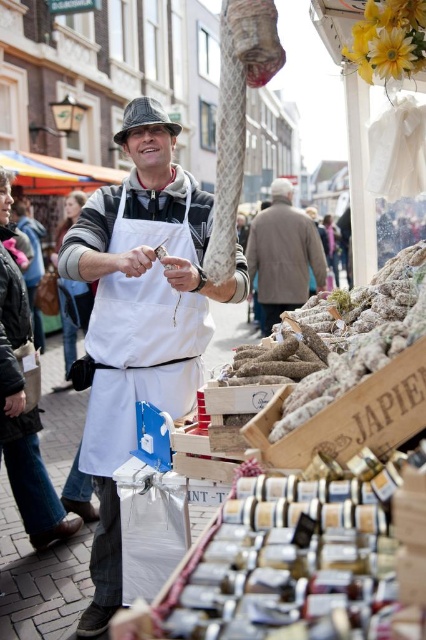
You are a customer at the market and want to determine which clothing item is shorter between the white canvas apron at center and the brown woolen coat at center. Which one is shorter?

The white canvas apron at center is shorter than the brown woolen coat at center because the white canvas apron at center is not as tall as brown woolen coat at center.

You are a customer at the market and want to find the vendor with the white apron at center. According to the spatial coordinates provided, where exactly is the white apron located?

The white apron at center is located at point (140,316).

You are standing at the entrance of the market and want to find the vendor who is holding a knife and a piece of meat. There are two points marked on the map of the market. Which point is closer to the vendor? The points are point (109, 276) and point (276, 268).

Point (109, 276) is in front of point (276, 268), so it is closer to the vendor.